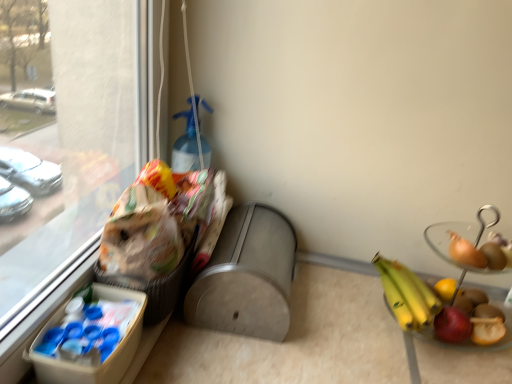
I want to click on plastic woven basket at left, so click(154, 286).

Describe the element at coordinates (154, 286) in the screenshot. The height and width of the screenshot is (384, 512). I see `plastic woven basket at left` at that location.

What do you see at coordinates (96, 323) in the screenshot? I see `white plastic lunch box at lower left` at bounding box center [96, 323].

Locate an element on the screen. Image resolution: width=512 pixels, height=384 pixels. white plastic lunch box at lower left is located at coordinates (96, 323).

In order to face white plastic lunch box at lower left, should I rotate leftwards or rightwards?

Rotate left and turn 20.469 degrees.

Measure the distance between white plastic lunch box at lower left and camera.

white plastic lunch box at lower left is 25.33 inches from camera.

Where is `plastic woven basket at left`? The image size is (512, 384). plastic woven basket at left is located at coordinates (154, 286).

Considering the positions of objects white plastic lunch box at lower left and plastic woven basket at left in the image provided, who is more to the right, white plastic lunch box at lower left or plastic woven basket at left?

From the viewer's perspective, plastic woven basket at left appears more on the right side.

Is white plastic lunch box at lower left closer to the viewer compared to plastic woven basket at left?

Yes, white plastic lunch box at lower left is closer to the viewer.

Does point (127, 347) come closer to viewer compared to point (153, 282)?

Yes, point (127, 347) is closer to viewer.

From the image's perspective, is white plastic lunch box at lower left over plastic woven basket at left?

No, from the image's perspective, white plastic lunch box at lower left is not over plastic woven basket at left.

From a real-world perspective, which object rests below the other?

white plastic lunch box at lower left, from a real-world perspective.

Considering the relative sizes of white plastic lunch box at lower left and plastic woven basket at left in the image provided, is white plastic lunch box at lower left thinner than plastic woven basket at left?

Yes, white plastic lunch box at lower left is thinner than plastic woven basket at left.

Does white plastic lunch box at lower left have a lesser height compared to plastic woven basket at left?

Yes.

Does white plastic lunch box at lower left have a larger size compared to plastic woven basket at left?

No, white plastic lunch box at lower left is not bigger than plastic woven basket at left.

Would you say white plastic lunch box at lower left is inside or outside plastic woven basket at left?

white plastic lunch box at lower left exists outside the volume of plastic woven basket at left.

Can you see white plastic lunch box at lower left touching plastic woven basket at left?

Yes.

Is white plastic lunch box at lower left turned away from plastic woven basket at left?

No, white plastic lunch box at lower left is not facing away from plastic woven basket at left.

Where is `basket that is behind the white plastic lunch box at lower left`? Image resolution: width=512 pixels, height=384 pixels. basket that is behind the white plastic lunch box at lower left is located at coordinates (154, 286).

Between plastic woven basket at left and white plastic lunch box at lower left, which one appears on the left side from the viewer's perspective?

Positioned to the left is white plastic lunch box at lower left.

Which object is further away from the camera, plastic woven basket at left or white plastic lunch box at lower left?

plastic woven basket at left.

Between point (195, 242) and point (117, 326), which one is positioned behind?

The point (195, 242) is farther from the camera.

From the picture: From the image's perspective, between plastic woven basket at left and white plastic lunch box at lower left, which one is located above?

plastic woven basket at left.

In the scene shown: From a real-world perspective, is plastic woven basket at left above or below white plastic lunch box at lower left?

plastic woven basket at left is situated higher than white plastic lunch box at lower left in the real world.

Between plastic woven basket at left and white plastic lunch box at lower left, which one has larger width?

With larger width is plastic woven basket at left.

Can you confirm if plastic woven basket at left is shorter than white plastic lunch box at lower left?

No.

Considering the sizes of objects plastic woven basket at left and white plastic lunch box at lower left in the image provided, who is bigger, plastic woven basket at left or white plastic lunch box at lower left?

plastic woven basket at left.

Is plastic woven basket at left situated inside white plastic lunch box at lower left or outside?

plastic woven basket at left is located beyond the bounds of white plastic lunch box at lower left.

Are plastic woven basket at left and white plastic lunch box at lower left located far from each other?

No, plastic woven basket at left is not far away from white plastic lunch box at lower left.

Does plastic woven basket at left turn towards white plastic lunch box at lower left?

No.

Can you tell me how much plastic woven basket at left and white plastic lunch box at lower left differ in facing direction?

They differ by 0.000133 degrees in their facing directions.

How far apart are plastic woven basket at left and white plastic lunch box at lower left?

plastic woven basket at left and white plastic lunch box at lower left are 3.73 inches apart from each other.

In the image, there is a plastic woven basket at left. Where is `lunch box below it (from the image's perspective)`? lunch box below it (from the image's perspective) is located at coordinates (96, 323).

Locate an element on the screen. The width and height of the screenshot is (512, 384). lunch box that appears on the left of plastic woven basket at left is located at coordinates (96, 323).

Locate an element on the screen. This screenshot has width=512, height=384. basket above the white plastic lunch box at lower left (from a real-world perspective) is located at coordinates (154, 286).